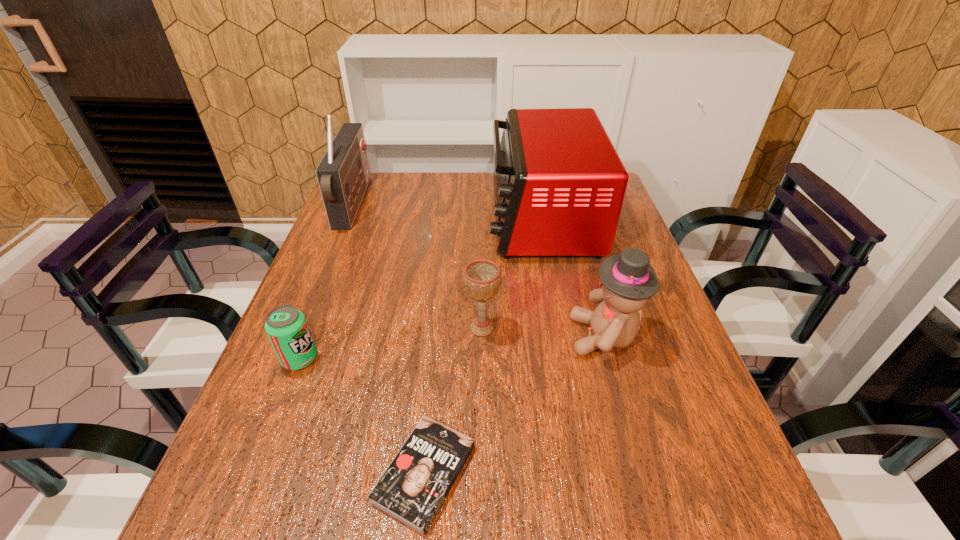
Image resolution: width=960 pixels, height=540 pixels. I want to click on radio receiver that is at the left edge, so point(343,174).

At what (x,y) coordinates should I click in order to perform the action: click on pop soda present at the left edge. Please return your answer as a coordinate pair (x, y). This screenshot has width=960, height=540. Looking at the image, I should click on pyautogui.click(x=287, y=329).

The height and width of the screenshot is (540, 960). I want to click on toaster oven at the right edge, so click(559, 185).

I want to click on rag_doll positioned at the right edge, so click(x=628, y=280).

You are a GUI agent. You are given a task and a screenshot of the screen. Output one action in this format:
    pyautogui.click(x=<x>, y=<y>)
    Task: Click on the object present at the far left corner
    This screenshot has height=540, width=960.
    Given the screenshot: What is the action you would take?
    pyautogui.click(x=343, y=174)

The width and height of the screenshot is (960, 540). I want to click on object that is positioned at the far right corner, so pyautogui.click(x=559, y=185).

Where is `free space at the far edge`? free space at the far edge is located at coordinates (432, 177).

Find the location of `free space at the left edge`. free space at the left edge is located at coordinates (257, 504).

This screenshot has height=540, width=960. What are the coordinates of `vacant space at the right edge` in the screenshot? It's located at (661, 407).

Locate an element on the screen. This screenshot has height=540, width=960. unoccupied area between the second shortest object and the chalice is located at coordinates (391, 343).